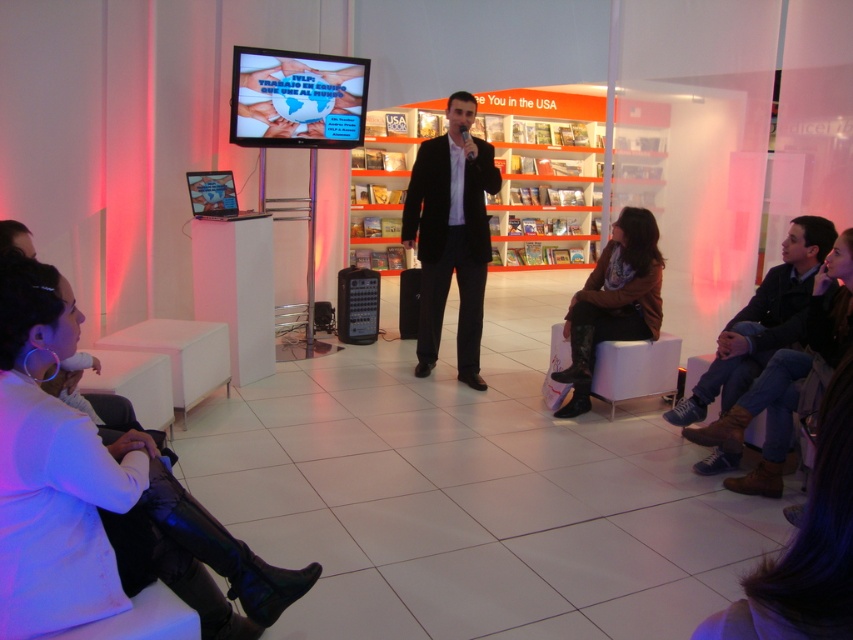
You are attending a presentation in a bookstore and notice two items of clothing in the scene. The dark blue jeans at lower right and the brown leather jacket at center. Which item is positioned lower in the image?

The dark blue jeans at lower right is located below the brown leather jacket at center, so it is positioned lower in the image.

Looking at this image, you are attending a presentation in a bookstore and notice two items in the room. One is the dark blue jeans at lower right and the other is the brown leather jacket at center. Which item is taller?

The dark blue jeans at lower right has a greater height compared to the brown leather jacket at center, so the dark blue jeans at lower right is taller.

You are planning to sit on a bench that can only accommodate objects up to the width of the brown leather jacket at center. Can the dark blue jeans at lower right fit on the bench?

The dark blue jeans at lower right has a larger width than the brown leather jacket at center, so it cannot fit on the bench designed for the jacket.